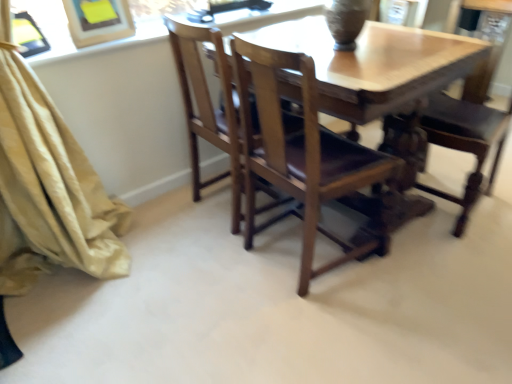
This screenshot has height=384, width=512. Identify the location of vacant area that lies to the right of wooden chair at center, the 1th chair from the left. (431, 269).